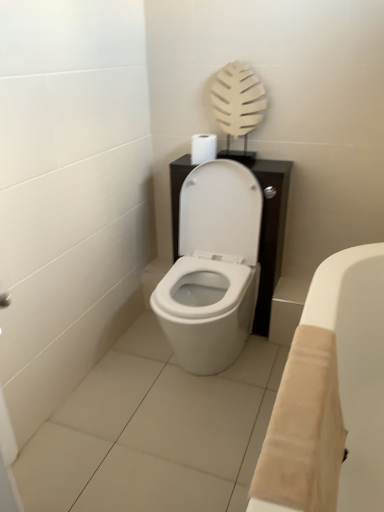
Identify the location of beige fabric bath at lower right. The image size is (384, 512). (330, 396).

What do you see at coordinates (330, 396) in the screenshot? I see `beige fabric bath at lower right` at bounding box center [330, 396].

Describe the element at coordinates (203, 148) in the screenshot. This screenshot has width=384, height=512. I see `white matte toilet paper at center` at that location.

Where is `white matte toilet paper at center`? white matte toilet paper at center is located at coordinates (203, 148).

The image size is (384, 512). I want to click on beige fabric bath at lower right, so click(330, 396).

Would you say white matte toilet paper at center is to the left or to the right of beige fabric bath at lower right in the picture?

Clearly, white matte toilet paper at center is on the left of beige fabric bath at lower right in the image.

Relative to beige fabric bath at lower right, is white matte toilet paper at center in front or behind?

white matte toilet paper at center is behind beige fabric bath at lower right.

Considering the positions of point (197, 139) and point (249, 490), is point (197, 139) closer or farther from the camera than point (249, 490)?

Point (197, 139) is farther from the camera than point (249, 490).

From the image's perspective, does white matte toilet paper at center appear higher than beige fabric bath at lower right?

Indeed, from the image's perspective, white matte toilet paper at center is shown above beige fabric bath at lower right.

From a real-world perspective, is white matte toilet paper at center physically above beige fabric bath at lower right?

Yes.

Looking at their sizes, would you say white matte toilet paper at center is wider or thinner than beige fabric bath at lower right?

Clearly, white matte toilet paper at center has less width compared to beige fabric bath at lower right.

Does white matte toilet paper at center have a lesser height compared to beige fabric bath at lower right?

Yes.

Does white matte toilet paper at center have a larger size compared to beige fabric bath at lower right?

No.

Based on the photo, is white matte toilet paper at center inside the boundaries of beige fabric bath at lower right, or outside?

white matte toilet paper at center lies outside beige fabric bath at lower right.

Would you consider white matte toilet paper at center to be distant from beige fabric bath at lower right?

Yes, white matte toilet paper at center is far from beige fabric bath at lower right.

Is white matte toilet paper at center looking in the opposite direction of beige fabric bath at lower right?

No, beige fabric bath at lower right is not at the back of white matte toilet paper at center.

Can you tell me how much white matte toilet paper at center and beige fabric bath at lower right differ in facing direction?

white matte toilet paper at center and beige fabric bath at lower right are facing 92.2 degrees away from each other.

You are a GUI agent. You are given a task and a screenshot of the screen. Output one action in this format:
    pyautogui.click(x=<x>, y=<y>)
    Task: Click on the bath located on the right of white matte toilet paper at center
    This screenshot has height=512, width=384.
    Given the screenshot: What is the action you would take?
    pyautogui.click(x=330, y=396)

Which is more to the left, beige fabric bath at lower right or white matte toilet paper at center?

white matte toilet paper at center.

Is the depth of beige fabric bath at lower right less than that of white matte toilet paper at center?

Yes, beige fabric bath at lower right is closer to the camera.

Is point (322, 457) closer or farther from the camera than point (211, 158)?

Point (322, 457) appears to be closer to the viewer than point (211, 158).

From the image's perspective, is beige fabric bath at lower right above or below white matte toilet paper at center?

Clearly, from the image's perspective, beige fabric bath at lower right is below white matte toilet paper at center.

From a real-world perspective, is beige fabric bath at lower right physically above white matte toilet paper at center?

No, from a real-world perspective, beige fabric bath at lower right is not above white matte toilet paper at center.

Is beige fabric bath at lower right wider or thinner than white matte toilet paper at center?

Clearly, beige fabric bath at lower right has more width compared to white matte toilet paper at center.

Does beige fabric bath at lower right have a greater height compared to white matte toilet paper at center?

Correct, beige fabric bath at lower right is much taller as white matte toilet paper at center.

Who is bigger, beige fabric bath at lower right or white matte toilet paper at center?

With larger size is beige fabric bath at lower right.

Do you think beige fabric bath at lower right is within white matte toilet paper at center, or outside of it?

beige fabric bath at lower right is outside white matte toilet paper at center.

Would you say beige fabric bath at lower right is a long distance from white matte toilet paper at center?

Yes, beige fabric bath at lower right and white matte toilet paper at center are quite far apart.

Is beige fabric bath at lower right facing away from white matte toilet paper at center?

beige fabric bath at lower right does not have its back to white matte toilet paper at center.

In order to click on bath on the right of white matte toilet paper at center in this screenshot , I will do `click(330, 396)`.

At what (x,y) coordinates should I click in order to perform the action: click on bath lying below the white matte toilet paper at center (from the image's perspective). Please return your answer as a coordinate pair (x, y). The width and height of the screenshot is (384, 512). Looking at the image, I should click on (330, 396).

This screenshot has height=512, width=384. In order to click on bath located underneath the white matte toilet paper at center (from a real-world perspective) in this screenshot , I will do `click(330, 396)`.